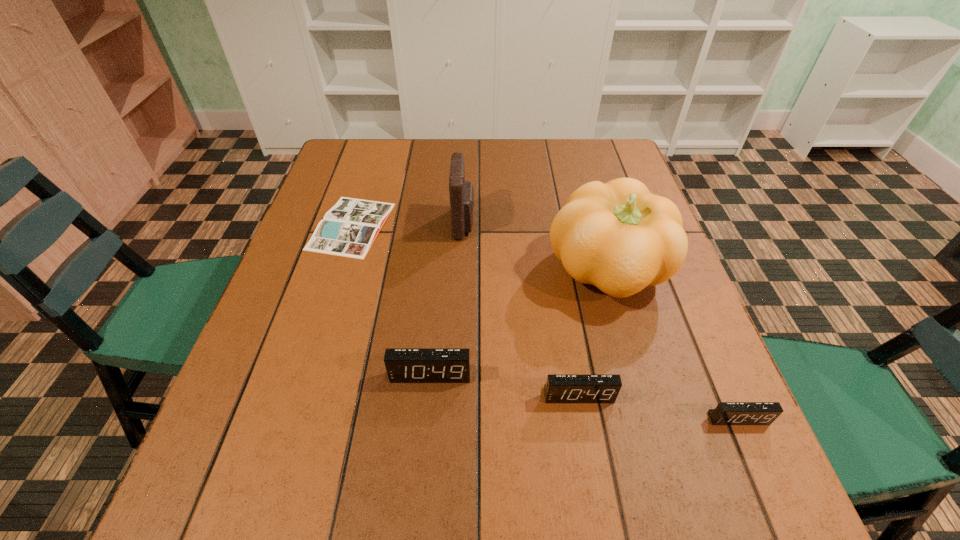
In order to click on the third tallest object in this screenshot , I will do `click(402, 365)`.

Where is `the farthest alarm clock`? This screenshot has height=540, width=960. the farthest alarm clock is located at coordinates (402, 365).

This screenshot has height=540, width=960. I want to click on the fourth tallest object, so click(559, 388).

Find the location of a particular element. the fifth farthest object is located at coordinates (559, 388).

At what (x,y) coordinates should I click in order to perform the action: click on the shortest alarm clock. Please return your answer as a coordinate pair (x, y). The image size is (960, 540). Looking at the image, I should click on (726, 413).

What are the coordinates of `the rightmost alarm clock` in the screenshot? It's located at (726, 413).

I want to click on the second tallest object, so click(x=461, y=192).

Where is `pumpkin`? pumpkin is located at coordinates (618, 236).

The width and height of the screenshot is (960, 540). What are the coordinates of `book` in the screenshot? It's located at (349, 228).

Identify the location of the leftmost object. The height and width of the screenshot is (540, 960). (349, 228).